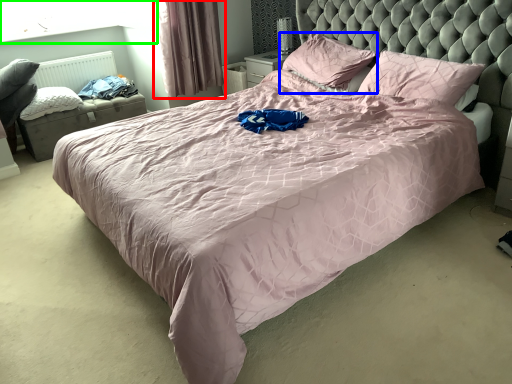
Question: Which is nearer to the curtain (highlighted by a red box)? pillow (highlighted by a blue box) or window screen (highlighted by a green box).

Choices:
 (A) pillow
 (B) window screen

Answer: (B)